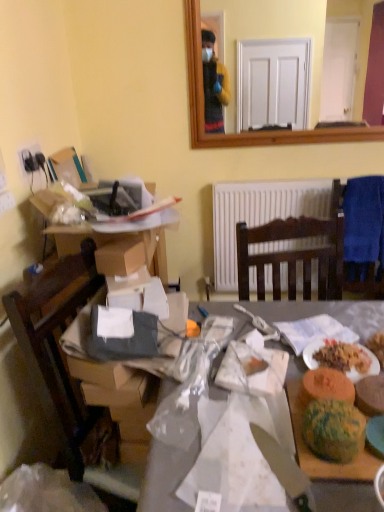
This screenshot has width=384, height=512. Identify the location of vacant area that is in front of multicolored plastic watermelon at lower right. (344, 476).